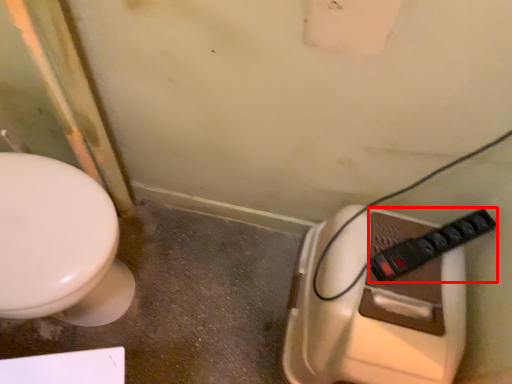
Question: From the image, what is the correct spatial relationship of plug (annotated by the red box) in relation to toilet?

Choices:
 (A) right
 (B) left

Answer: (A)